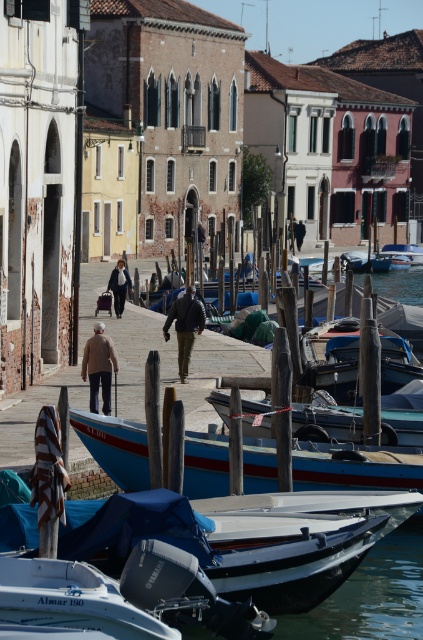
You are standing on the walkway and want to hand a note to the person wearing the light brown wool coat at center. The blue wooden boat at center is between you and the person. Can you reach the person without moving the boat?

The light brown wool coat at center is closer to the viewer than the blue wooden boat at center, so you can reach the person without moving the boat because the person is in front of the boat.

You are standing on the walkway and see the blue tarpaulin boat at lower center and the matte black coat at center. Which object is positioned to the right side?

The blue tarpaulin boat at lower center is to the right of matte black coat at center, so the blue tarpaulin boat at lower center is positioned to the right side.

You are standing at the point marked by coordinates point (71, 600), which is the location of the white matte boat at lower left. You want to walk towards the two people walking away from you on the paved walkway in the middle ground. Which direction should you go?

You should walk towards the middle ground where the two people are walking away from you, so you need to move forward from the white matte boat at lower left towards the center of the image.